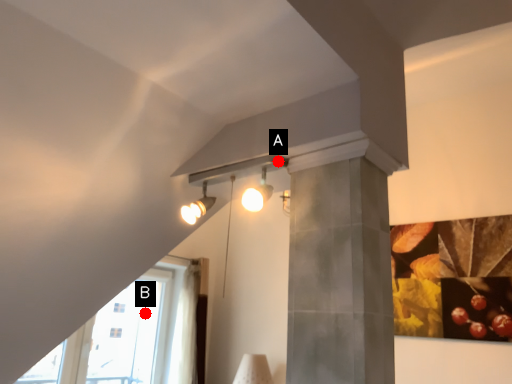
Question: Two points are circled on the image, labeled by A and B beside each circle. Which point is farther from the camera taking this photo?

Choices:
 (A) A is further
 (B) B is further

Answer: (B)